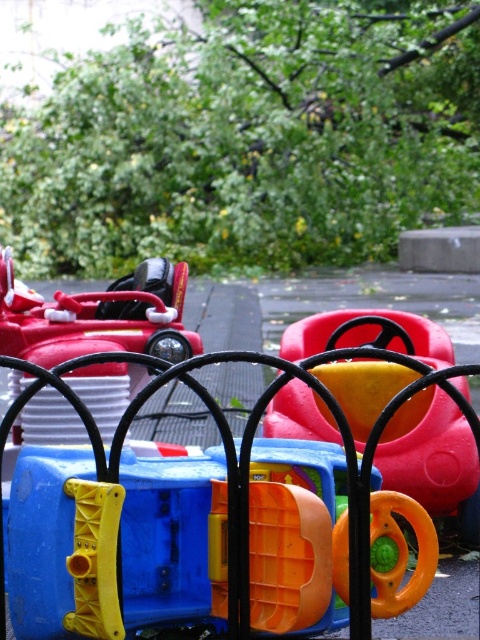
You are standing at the entrance of the playground and see two points marked in the image. The first point is at coordinates point (359,525) and the second is at point (364,413). Which point is closer to you?

Point (359,525) is in front of point (364,413), so it is closer to you.

You are standing at the center of the playground and want to locate the blue plastic steering wheel at center. According to the coordinates provided, where should you look relative to the center of the image?

The blue plastic steering wheel at center is located at coordinates point (192, 529), which means it is positioned to the right and slightly above the center of the image.

You are a child trying to decide between playing with the blue plastic steering wheel at center and the shiny red car at center. Which object would you choose if you want to hold something bigger?

The blue plastic steering wheel at center is larger in size than the shiny red car at center, so you should choose the blue plastic steering wheel at center.